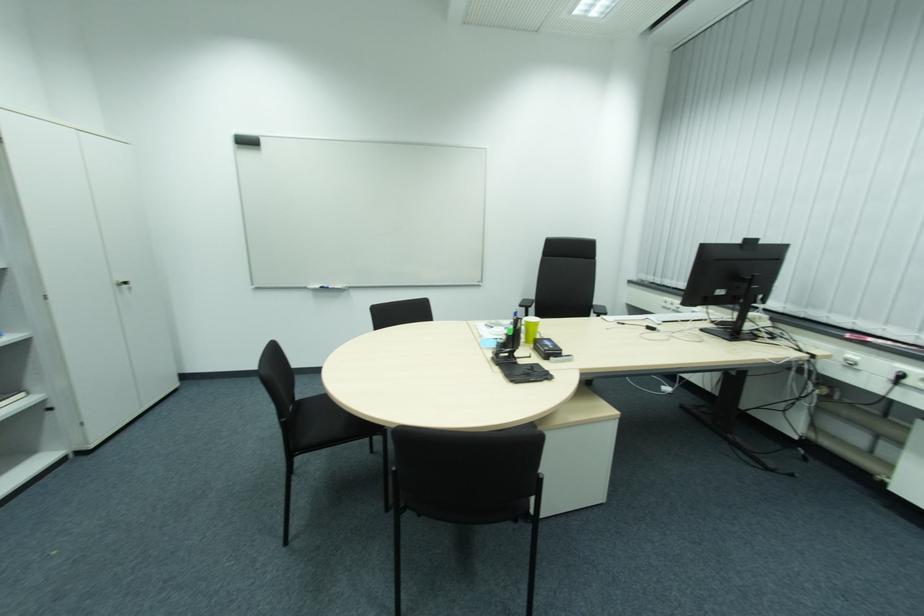
Where would you pull the white cabinet handle? Please return your answer as a coordinate pair (x, y).

(123, 284)